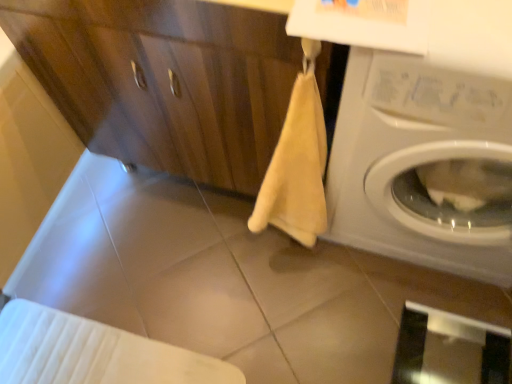
This screenshot has height=384, width=512. I want to click on vacant space underneath beige matte tile at center (from a real-world perspective), so (x=206, y=296).